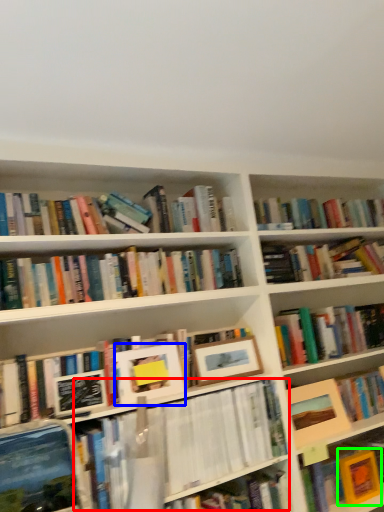
Question: Which object is the farthest from book (highlighted by a red box)? Choose among these: picture frame (highlighted by a blue box) or paperback book (highlighted by a green box).

Choices:
 (A) picture frame
 (B) paperback book

Answer: (B)